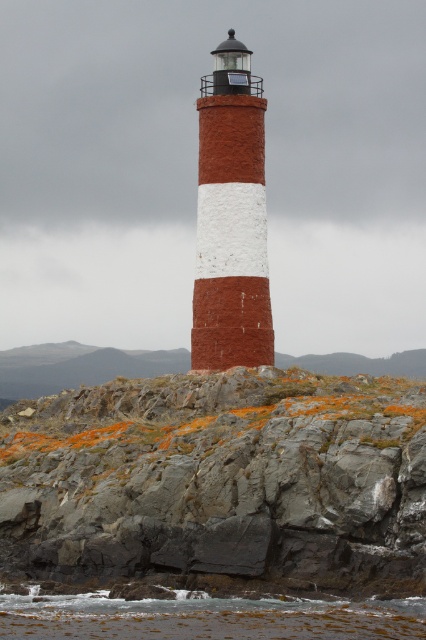
Question: Estimate the real-world distances between objects in this image. Which object is closer to the clear water at lower center?

Choices:
 (A) gray rock at center
 (B) brick red lighthouse at center

Answer: (A)

Question: Is gray rock at center thinner than brick red lighthouse at center?

Choices:
 (A) no
 (B) yes

Answer: (A)

Question: Can you confirm if brick red lighthouse at center is wider than clear water at lower center?

Choices:
 (A) no
 (B) yes

Answer: (A)

Question: Which point is closer to the camera?

Choices:
 (A) (362, 416)
 (B) (253, 198)

Answer: (A)

Question: Which object is the closest to the clear water at lower center?

Choices:
 (A) gray rock at center
 (B) brick red lighthouse at center

Answer: (A)

Question: Is gray rock at center above clear water at lower center?

Choices:
 (A) yes
 (B) no

Answer: (A)